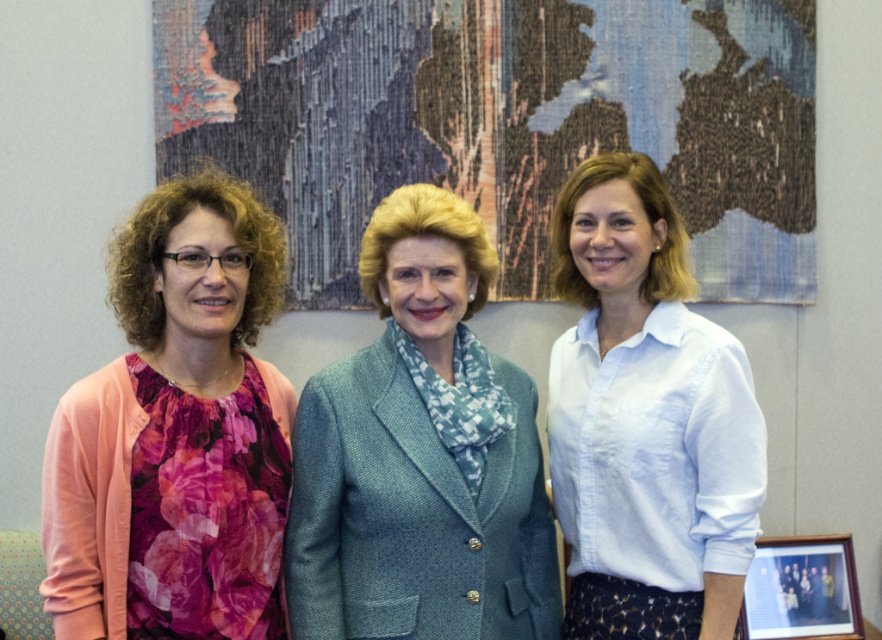
Is textured fabric map at upper center smaller than white cotton shirt at center?

Actually, textured fabric map at upper center might be larger than white cotton shirt at center.

In order to click on textured fabric map at upper center in this screenshot , I will do (501, 120).

This screenshot has width=882, height=640. I want to click on textured fabric map at upper center, so [x=501, y=120].

Can you confirm if floral fabric blouse at left is positioned to the right of white cotton shirt at center?

Incorrect, floral fabric blouse at left is not on the right side of white cotton shirt at center.

Is floral fabric blouse at left positioned behind white cotton shirt at center?

No.

Does point (251, 436) come farther from viewer compared to point (659, 573)?

No, (251, 436) is closer to viewer.

At what (x,y) coordinates should I click in order to perform the action: click on floral fabric blouse at left. Please return your answer as a coordinate pair (x, y). This screenshot has height=640, width=882. Looking at the image, I should click on (176, 433).

Is point (499, 106) less distant than point (218, 225)?

No, it is behind (218, 225).

Who is lower down, textured fabric map at upper center or floral fabric blouse at left?

floral fabric blouse at left

Where is `textured fabric map at upper center`? This screenshot has height=640, width=882. textured fabric map at upper center is located at coordinates [501, 120].

You are a GUI agent. You are given a task and a screenshot of the screen. Output one action in this format:
    pyautogui.click(x=<x>, y=<y>)
    Task: Click on the textured fabric map at upper center
    The width and height of the screenshot is (882, 640).
    Given the screenshot: What is the action you would take?
    pyautogui.click(x=501, y=120)